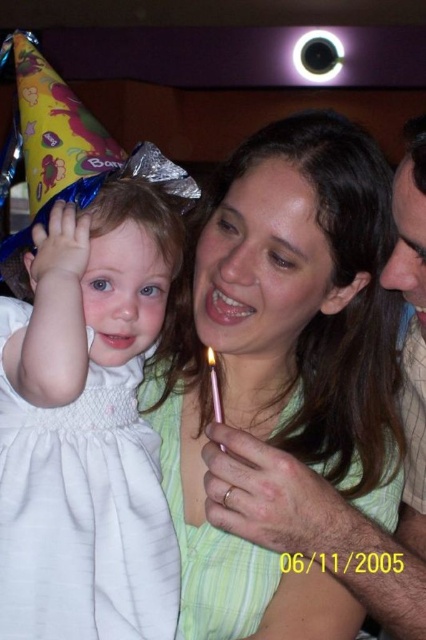
Who is positioned more to the left, green striped dress at center or white satin dress at left?

white satin dress at left

Is green striped dress at center positioned in front of white satin dress at left?

That is False.

Does point (296, 593) come closer to viewer compared to point (155, 588)?

No.

You are a GUI agent. You are given a task and a screenshot of the screen. Output one action in this format:
    pyautogui.click(x=<x>, y=<y>)
    Task: Click on the green striped dress at center
    This screenshot has height=640, width=426.
    Given the screenshot: What is the action you would take?
    pyautogui.click(x=282, y=364)

Between point (368, 442) and point (212, 384), which one is positioned in front?

Point (212, 384)

Does green striped dress at center have a larger size compared to pink metallic candle at center?

Indeed, green striped dress at center has a larger size compared to pink metallic candle at center.

What do you see at coordinates (282, 364) in the screenshot? The height and width of the screenshot is (640, 426). I see `green striped dress at center` at bounding box center [282, 364].

Identify the location of green striped dress at center. This screenshot has width=426, height=640. (282, 364).

Who is lower down, white satin dress at left or pink metallic candle at center?

white satin dress at left is lower down.

Measure the distance between white satin dress at left and camera.

white satin dress at left is 23.63 inches from camera.

Find the location of a particular element. white satin dress at left is located at coordinates (86, 428).

Where is `white satin dress at left`? white satin dress at left is located at coordinates (86, 428).